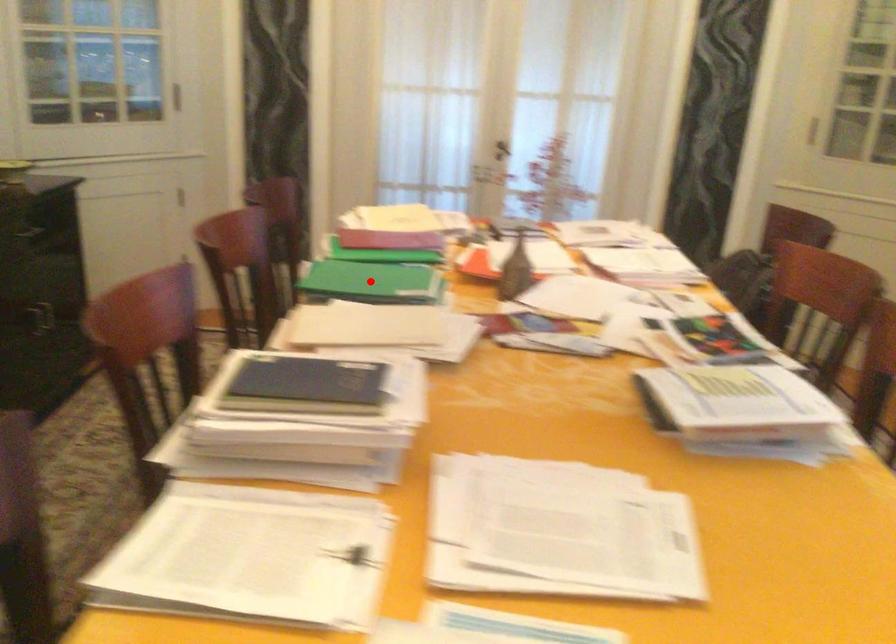
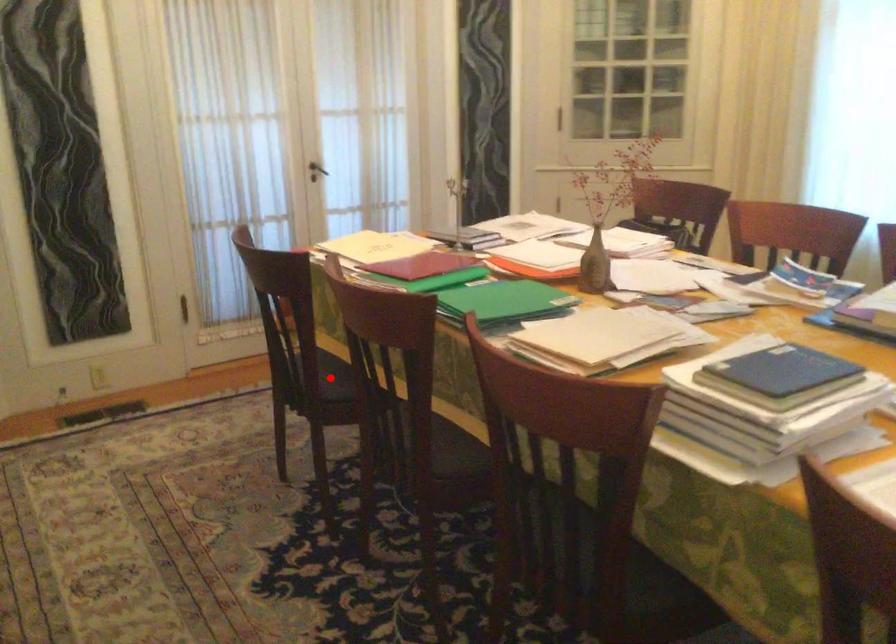
I am providing you with two images of the same scene from different viewpoints. A red point is marked on the first image and another point is marked on the second image. Is the marked point in image1 the same physical position as the marked point in image2?

No